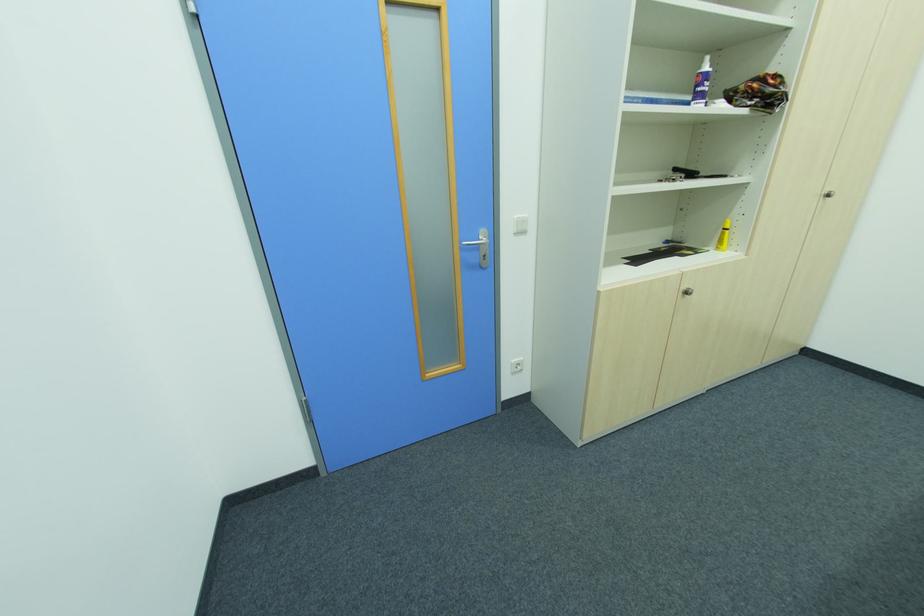
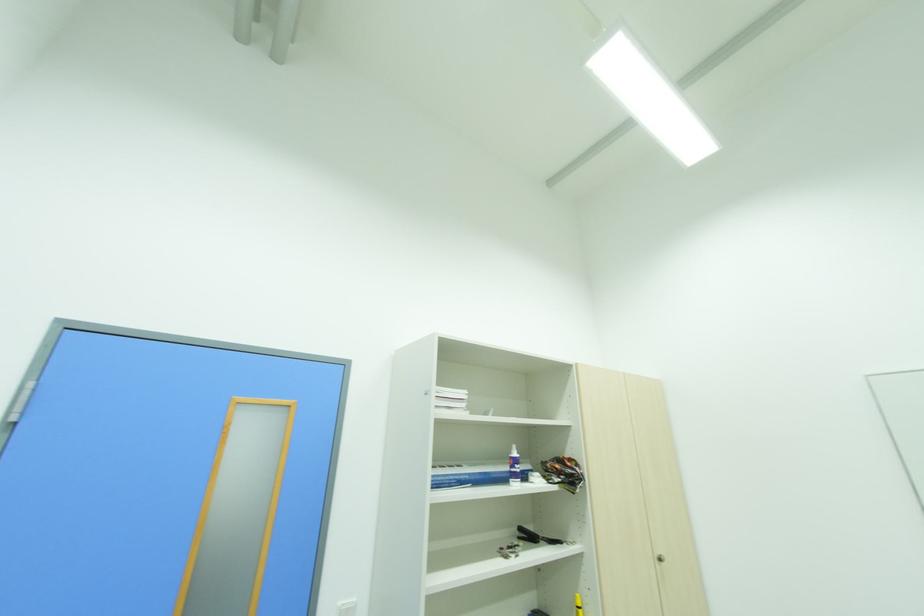
Locate, in the second image, the point that corresponds to point 518,217 in the first image.

(344, 604)